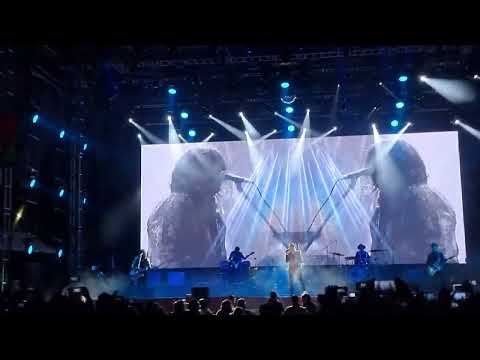
Identify the location of spotlights. (306, 112), (239, 113), (170, 116), (374, 124).